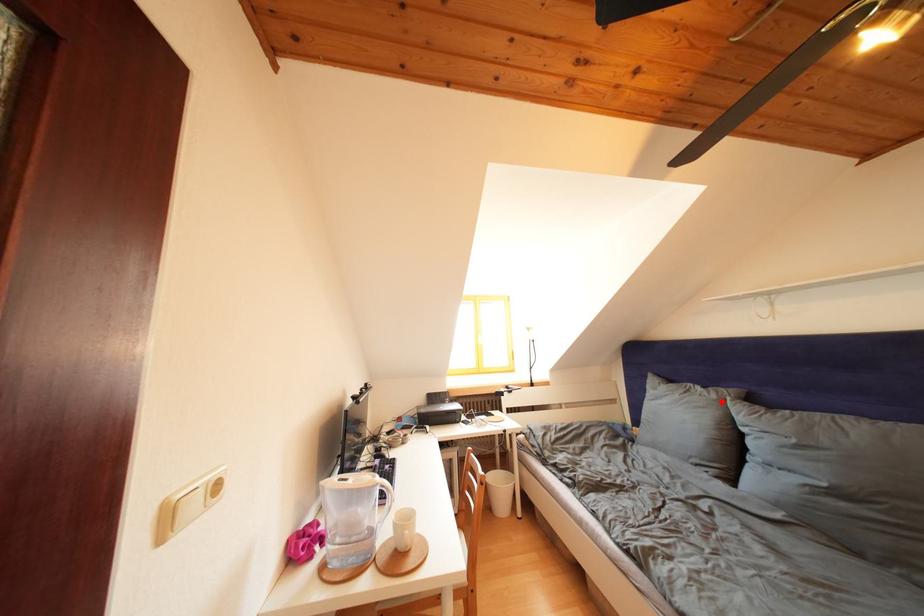
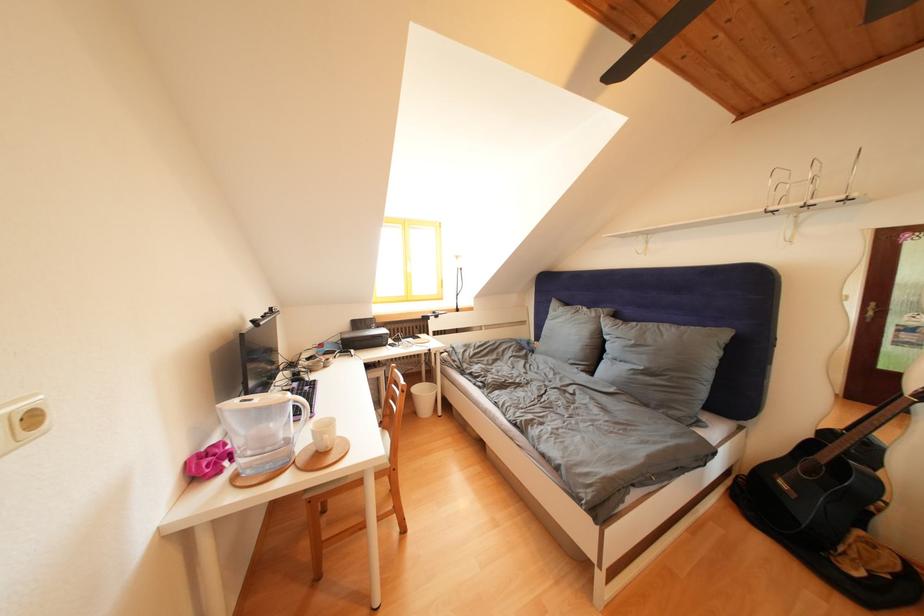
Locate, in the second image, the point that corresponds to the highlighted location in the first image.

(602, 320)